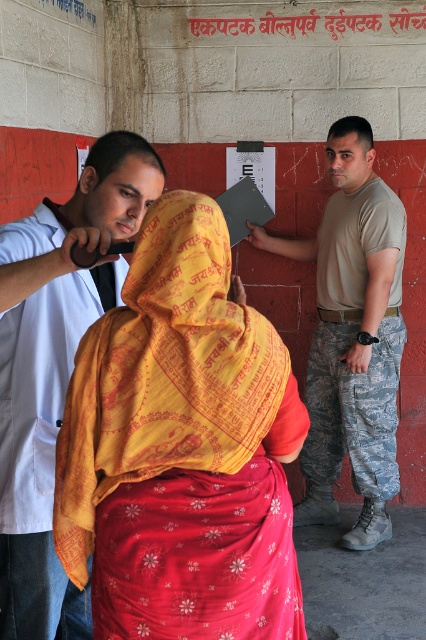
Is white lab coat at left to the right of camouflage pants at right from the viewer's perspective?

Incorrect, white lab coat at left is not on the right side of camouflage pants at right.

Who is more forward, (3, 584) or (377, 257)?

Point (3, 584)

What do you see at coordinates (55, 368) in the screenshot? This screenshot has height=640, width=426. I see `white lab coat at left` at bounding box center [55, 368].

What are the coordinates of `white lab coat at left` in the screenshot? It's located at (55, 368).

This screenshot has width=426, height=640. Identify the location of yellow printed fabric at center. (181, 449).

Between point (212, 371) and point (13, 307), which one is positioned in front?

Positioned in front is point (212, 371).

Does point (66, 568) lie in front of point (45, 577)?

Yes, point (66, 568) is closer to viewer.

The height and width of the screenshot is (640, 426). Find the location of `yellow printed fabric at center`. yellow printed fabric at center is located at coordinates (181, 449).

Is yellow printed fabric at center positioned before camouflage pants at right?

Yes, it is in front of camouflage pants at right.

Between point (175, 212) and point (307, 371), which one is positioned in front?

Point (175, 212) is in front.

Locate an element on the screen. The height and width of the screenshot is (640, 426). yellow printed fabric at center is located at coordinates (181, 449).